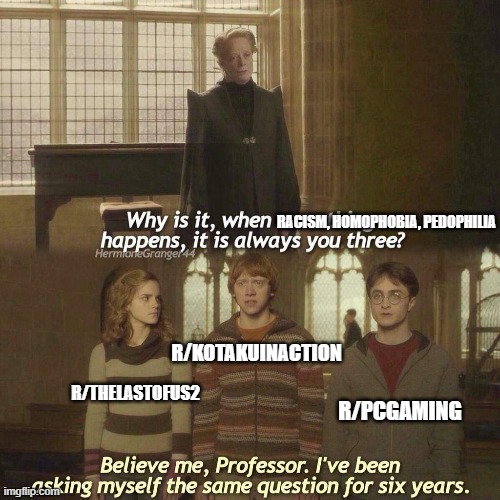
You are a GUI agent. You are given a task and a screenshot of the screen. Output one action in this format:
    pyautogui.click(x=<x>, y=<y>)
    Task: Click on the desk
    The height and width of the screenshot is (500, 500).
    Given the screenshot: What is the action you would take?
    pyautogui.click(x=111, y=166)